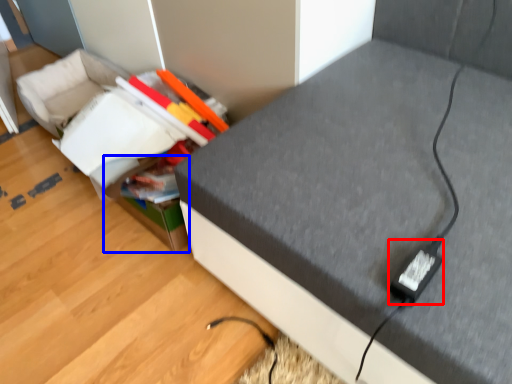
Question: Which of the following is the farthest to the observer, plug (highlighted by a red box) or storage box (highlighted by a blue box)?

Choices:
 (A) plug
 (B) storage box

Answer: (B)